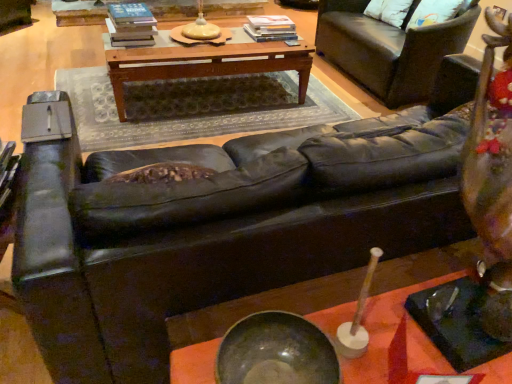
Locate an element on the screen. This screenshot has width=512, height=384. free space to the back side of shiny metallic bowl at center is located at coordinates (292, 306).